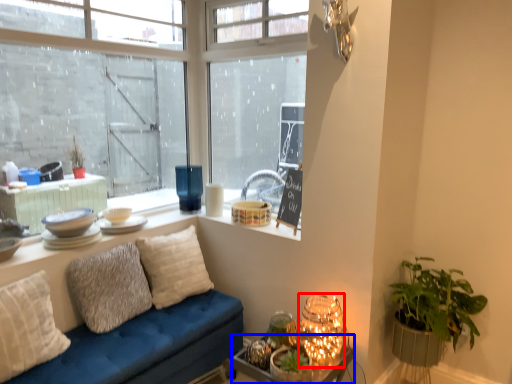
Question: Which object appears farthest to the camera in this image, table (highlighted by a red box) or table (highlighted by a blue box)?

Choices:
 (A) table
 (B) table

Answer: (A)